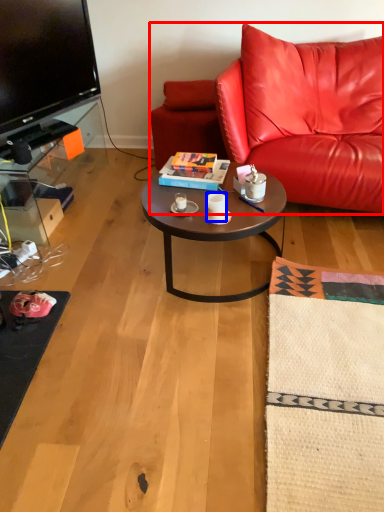
Question: Which of the following is the farthest to the observer, studio couch (highlighted by a red box) or coffee cup (highlighted by a blue box)?

Choices:
 (A) studio couch
 (B) coffee cup

Answer: (B)